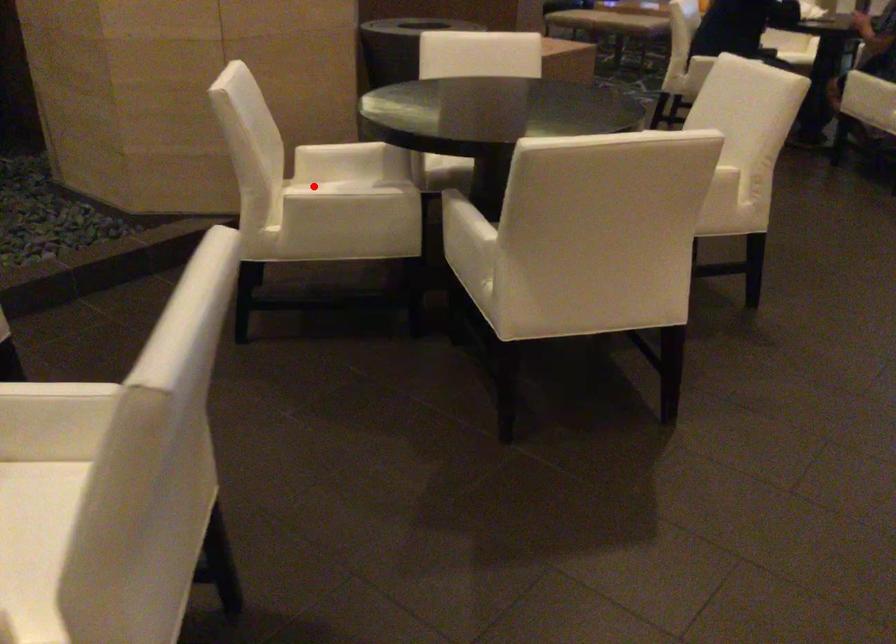
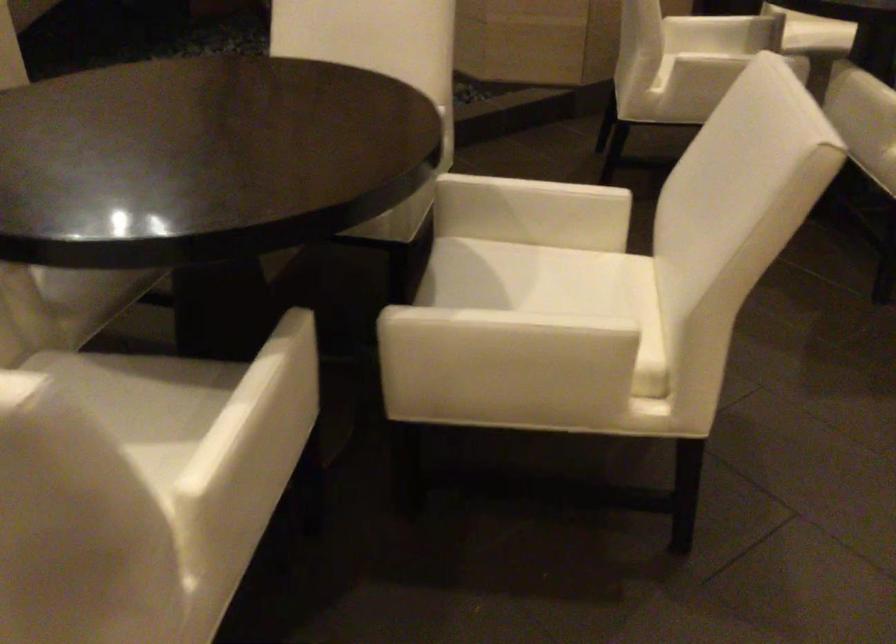
In the second image, find the point that corresponds to the highlighted location in the first image.

(687, 43)